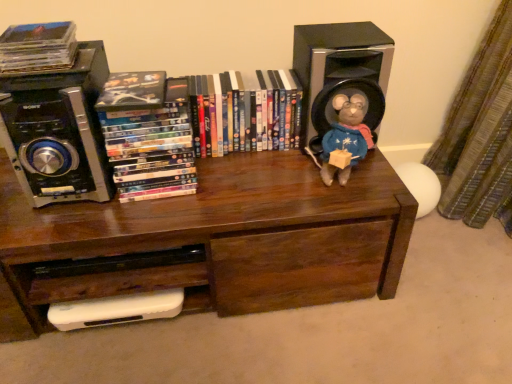
Locate an element on the screen. The width and height of the screenshot is (512, 384). vacant area in front of matte black compact disc at upper left, the 3th book positioned from the right is located at coordinates (30, 88).